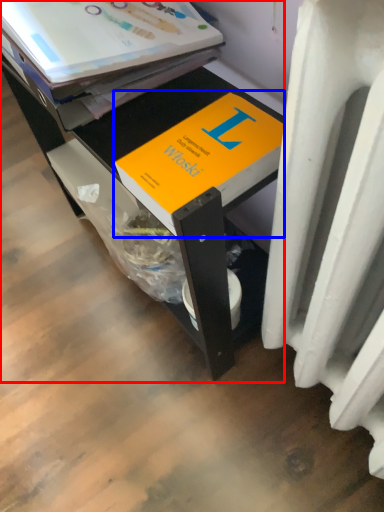
Question: Which of the following is the farthest to the observer, desk (highlighted by a red box) or book (highlighted by a blue box)?

Choices:
 (A) desk
 (B) book

Answer: (B)